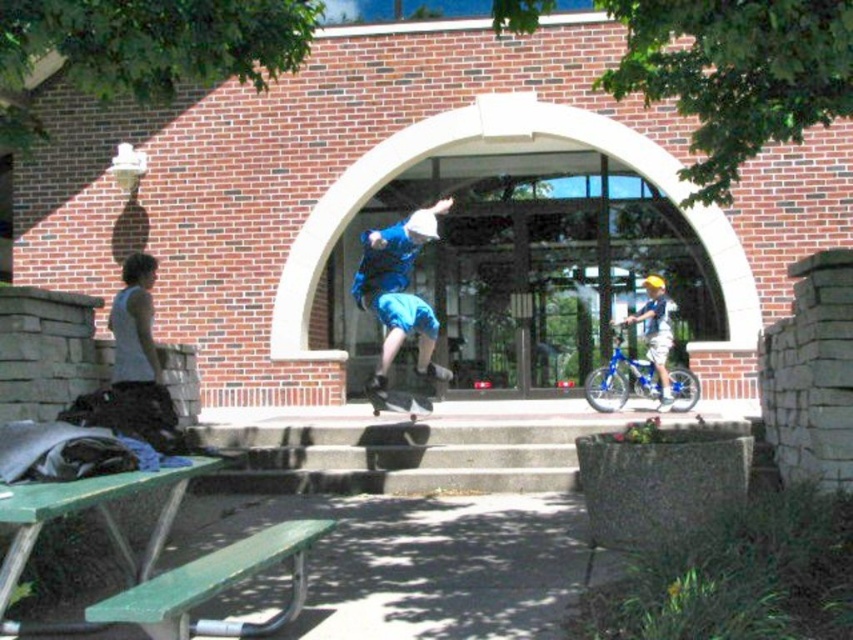
Between green painted wood park bench at lower left and blue denim shorts at center, which one appears on the left side from the viewer's perspective?

green painted wood park bench at lower left

Is green painted wood park bench at lower left to the left of blue denim shorts at center from the viewer's perspective?

Correct, you'll find green painted wood park bench at lower left to the left of blue denim shorts at center.

The image size is (853, 640). What do you see at coordinates (215, 586) in the screenshot? I see `green painted wood park bench at lower left` at bounding box center [215, 586].

Identify the location of green painted wood park bench at lower left. This screenshot has height=640, width=853. pos(215,586).

Which of these two, green plastic picnic table at lower left or blue denim shorts at center, stands taller?

blue denim shorts at center is taller.

Which is in front, point (10, 579) or point (401, 266)?

Positioned in front is point (10, 579).

Where is `green plastic picnic table at lower left`? green plastic picnic table at lower left is located at coordinates (100, 516).

Between green plastic picnic table at lower left and black smooth skateboard at center, which one appears on the right side from the viewer's perspective?

Positioned to the right is black smooth skateboard at center.

Does green plastic picnic table at lower left appear over black smooth skateboard at center?

Yes.

Identify the location of green plastic picnic table at lower left. The width and height of the screenshot is (853, 640). (100, 516).

Where is `green plastic picnic table at lower left`? green plastic picnic table at lower left is located at coordinates (100, 516).